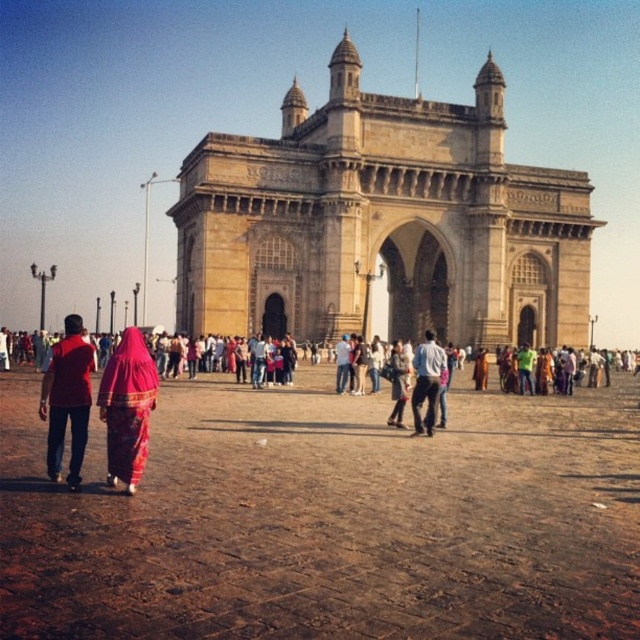
Question: Does brown stone dirt field at center appear over matte red shirt at left?

Choices:
 (A) no
 (B) yes

Answer: (A)

Question: Among these objects, which one is farthest from the camera?

Choices:
 (A) beige stone gateway of india at center
 (B) brown stone dirt field at center
 (C) silky red saree at lower left

Answer: (A)

Question: Among these points, which one is nearest to the camera?

Choices:
 (A) (58, 358)
 (B) (113, 444)
 (C) (433, 426)

Answer: (B)

Question: Which of these objects is positioned closest to the beige stone gateway of india at center?

Choices:
 (A) denim jacket at center
 (B) matte red shirt at left
 (C) silky red saree at lower left

Answer: (A)

Question: Does matte red shirt at left come behind denim jacket at center?

Choices:
 (A) yes
 (B) no

Answer: (B)

Question: Is brown stone dirt field at center below denim jacket at center?

Choices:
 (A) yes
 (B) no

Answer: (A)